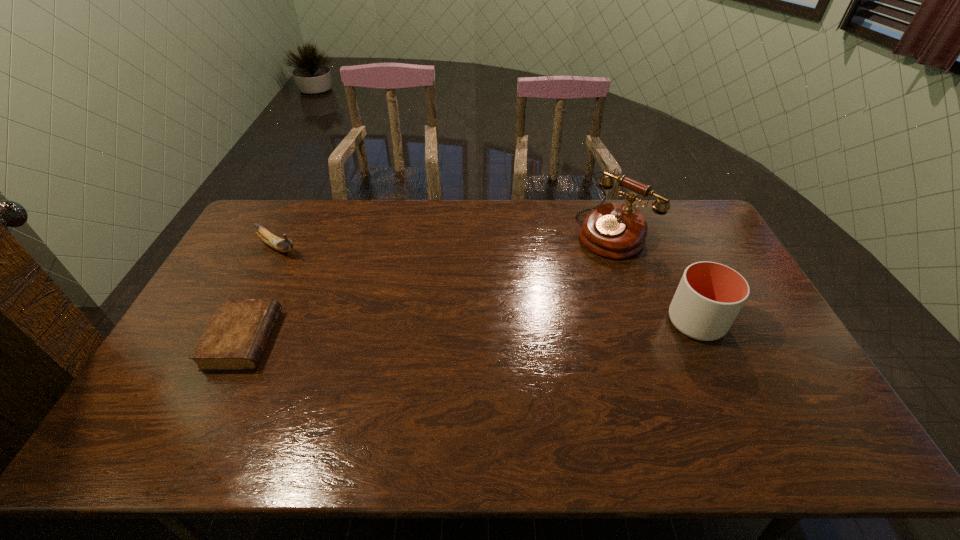
At what (x,y) coordinates should I click in order to perform the action: click on diary. Please return your answer as a coordinate pair (x, y). The height and width of the screenshot is (540, 960). Looking at the image, I should click on (235, 339).

This screenshot has width=960, height=540. In order to click on cup in this screenshot , I will do `click(710, 295)`.

Find the location of a particular element. banana is located at coordinates (283, 245).

In order to click on the tallest object in this screenshot , I will do `click(614, 230)`.

Locate an element on the screen. vacant region located 0.120m on the spine side of the diary is located at coordinates (315, 340).

Locate an element on the screen. The width and height of the screenshot is (960, 540). blank area located 0.360m on the back of the cup is located at coordinates (654, 229).

In order to click on vacant space situated 0.320m at the stem of the second shortest object in this screenshot , I will do coord(358,296).

The width and height of the screenshot is (960, 540). In order to click on vacant space situated 0.120m at the stem of the second shortest object in this screenshot , I will do `click(316, 270)`.

Where is `free space located at the stem of the second shortest object`? free space located at the stem of the second shortest object is located at coordinates (324, 275).

The height and width of the screenshot is (540, 960). I want to click on vacant point located 0.100m on the dial of the telephone, so pyautogui.click(x=576, y=266).